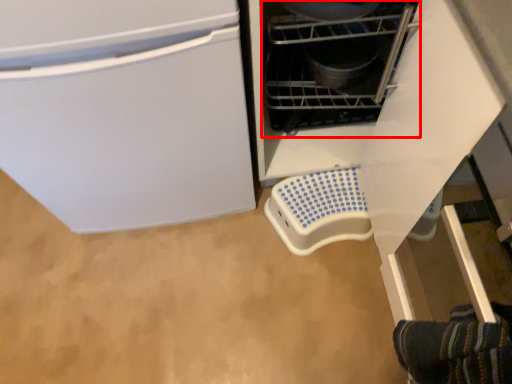
Question: From the image, what is the correct spatial relationship of appliance (annotated by the red box) in relation to appliance?

Choices:
 (A) right
 (B) left

Answer: (B)